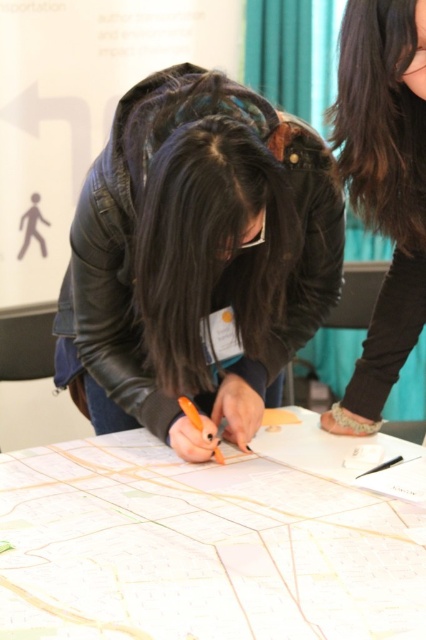
Question: Does white paper map at center lie in front of black leather jacket at upper right?

Choices:
 (A) yes
 (B) no

Answer: (A)

Question: Which object appears closest to the camera in this image?

Choices:
 (A) black leather jacket at upper right
 (B) leather jacket at center
 (C) white paper map at center

Answer: (C)

Question: Is white paper map at center smaller than black leather jacket at upper right?

Choices:
 (A) yes
 (B) no

Answer: (B)

Question: Is leather jacket at center to the left of black leather jacket at upper right from the viewer's perspective?

Choices:
 (A) yes
 (B) no

Answer: (A)

Question: Which point is farther to the camera?

Choices:
 (A) tap(149, 260)
 (B) tap(169, 620)

Answer: (A)

Question: Which point is closer to the camera?

Choices:
 (A) white paper map at center
 (B) leather jacket at center

Answer: (A)